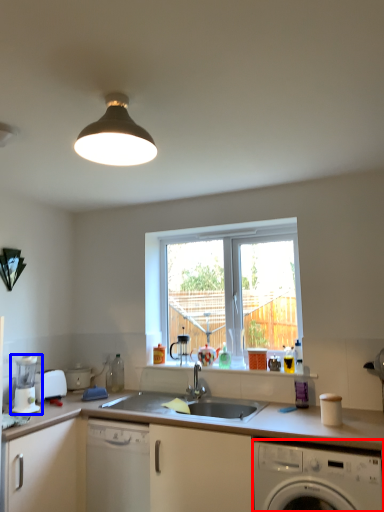
Question: Which object is closer to the camera taking this photo, washing machine (highlighted by a red box) or coffee machine (highlighted by a blue box)?

Choices:
 (A) washing machine
 (B) coffee machine

Answer: (A)